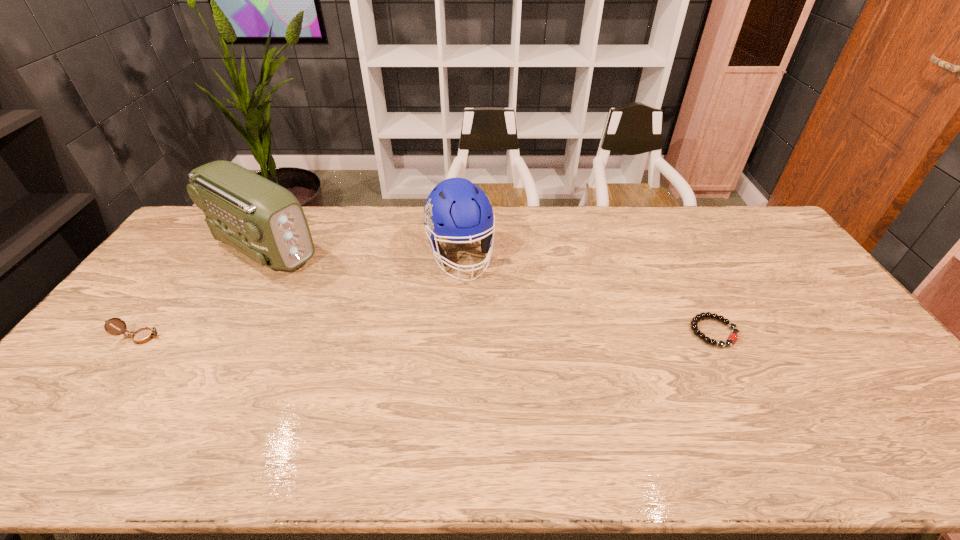
Locate an element on the screen. The height and width of the screenshot is (540, 960). vacant space situated on the front-facing side of the radio_receiver is located at coordinates [339, 288].

At what (x,y) coordinates should I click in order to perform the action: click on free region located on the front-facing side of the radio_receiver. Please return your answer as a coordinate pair (x, y). This screenshot has height=540, width=960. Looking at the image, I should click on (328, 281).

Image resolution: width=960 pixels, height=540 pixels. I want to click on vacant space located 0.400m on the front-facing side of the radio_receiver, so point(392,320).

At what (x,y) coordinates should I click in order to perform the action: click on football helmet located at the far edge. Please return your answer as a coordinate pair (x, y). This screenshot has width=960, height=540. Looking at the image, I should click on (456, 209).

I want to click on radio_receiver at the far edge, so click(x=264, y=221).

Identify the location of compass that is at the left edge. The width and height of the screenshot is (960, 540). (143, 335).

I want to click on radio_receiver located at the left edge, so click(x=264, y=221).

Where is `object situated at the far left corner`? object situated at the far left corner is located at coordinates (264, 221).

Where is `free location at the far edge`? free location at the far edge is located at coordinates (636, 219).

This screenshot has width=960, height=540. In the image, there is a desktop. In order to click on vacant space at the near edge in this screenshot , I will do `click(679, 394)`.